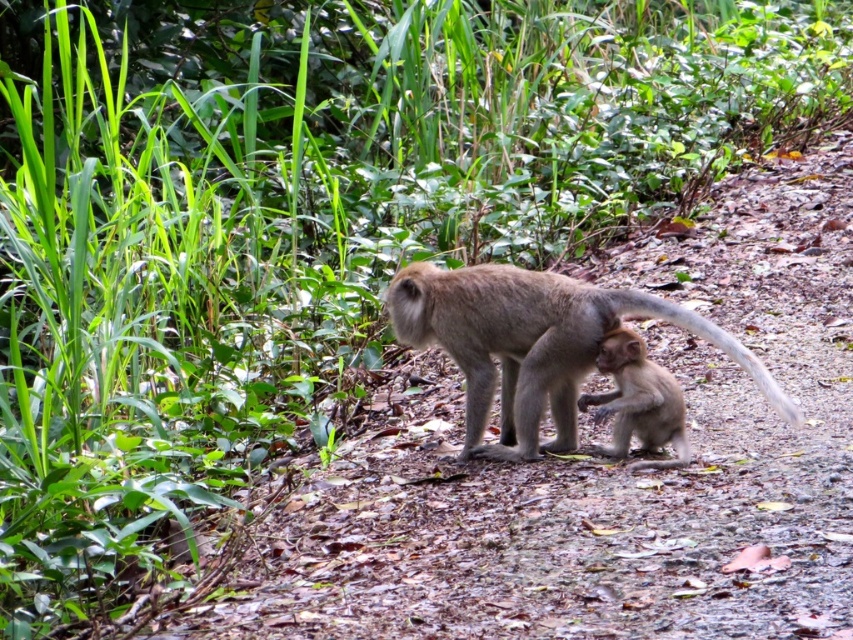
You are a wildlife photographer trying to capture a closeup shot of both monkeys. You have a lens that can focus on objects up to 2 meters away. The distance between the brown furry monkey at center and smooth brown monkey at center is 1.2 meters. Can your lens capture both monkeys in one shot?

The distance between the brown furry monkey at center and smooth brown monkey at center is 1.2 meters, which is within the 2 meters range of your lens. Therefore, your lens can capture both monkeys in one shot.

You are a wildlife photographer observing two monkeys in a forest. You need to determine their positions relative to each other to frame your shot. Which monkey is positioned higher up in the image, the brown furry monkey at center or the smooth brown monkey at center?

The brown furry monkey at center is much taller than the smooth brown monkey at center, so the brown furry monkey at center is positioned higher up in the image.

You are a wildlife photographer aiming to capture a closeup shot of the brown furry monkey at center. You are currently positioned at point (532,342). Can you directly photograph the monkey without moving from your current position?

Yes, because the brown furry monkey at center is located exactly at point (532,342) where you are standing, so you can photograph it directly from your current position.